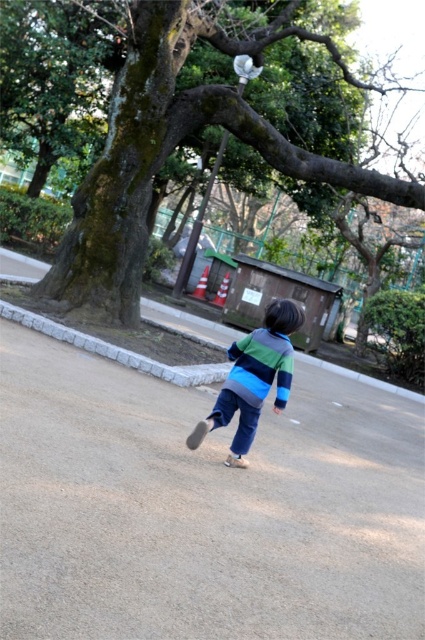
Does green mossy tree at upper left have a lesser height compared to striped sweater at center?

Yes, green mossy tree at upper left is shorter than striped sweater at center.

Identify the location of green mossy tree at upper left. (170, 150).